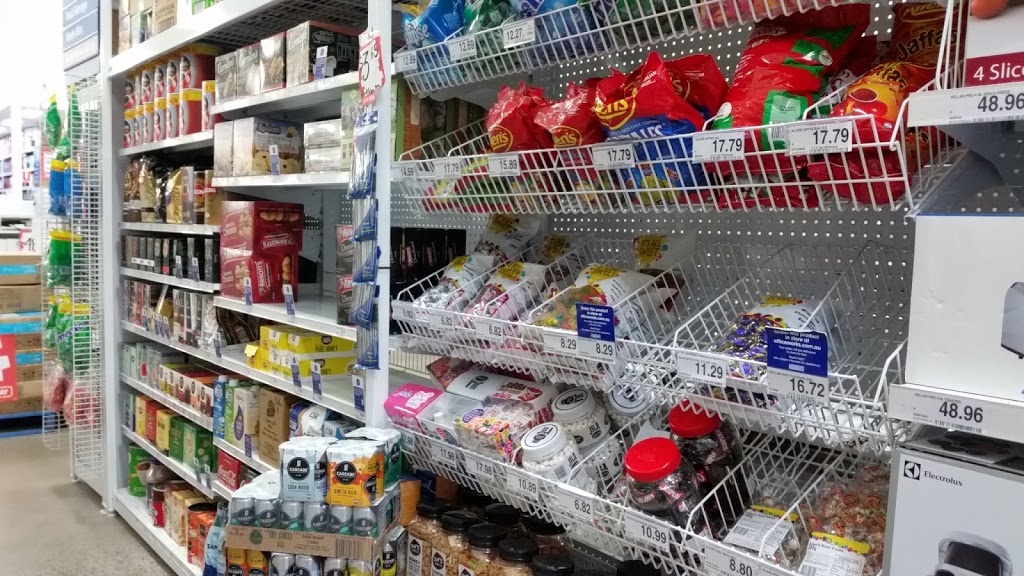
I want to click on appliances, so click(957, 529), click(955, 327), click(983, 44), click(26, 271), click(23, 291), click(26, 338), click(31, 371).